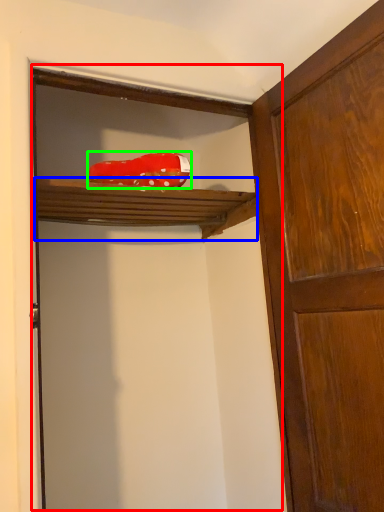
Question: Considering the real-world distances, which object is closest to door (highlighted by a red box)? shelf (highlighted by a blue box) or material (highlighted by a green box).

Choices:
 (A) shelf
 (B) material

Answer: (A)